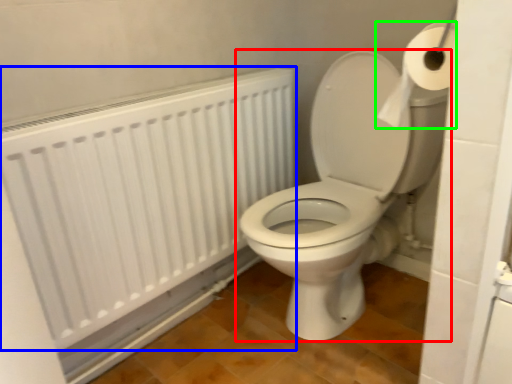
Question: Considering the real-world distances, which object is closest to toilet (highlighted by a red box)? radiator (highlighted by a blue box) or toilet paper (highlighted by a green box).

Choices:
 (A) radiator
 (B) toilet paper

Answer: (A)